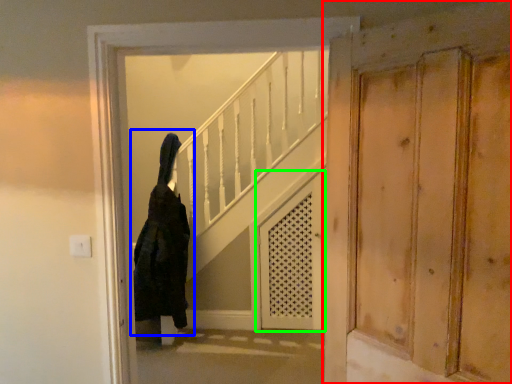
Question: Considering the real-world distances, which object is farthest from door (highlighted by a red box)? woman (highlighted by a blue box) or screen door (highlighted by a green box)?

Choices:
 (A) woman
 (B) screen door

Answer: (A)